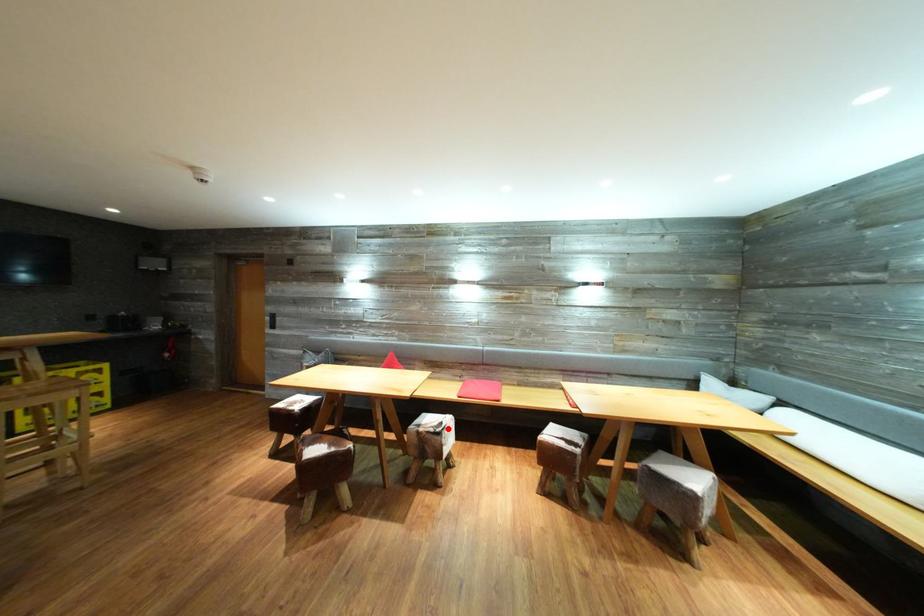
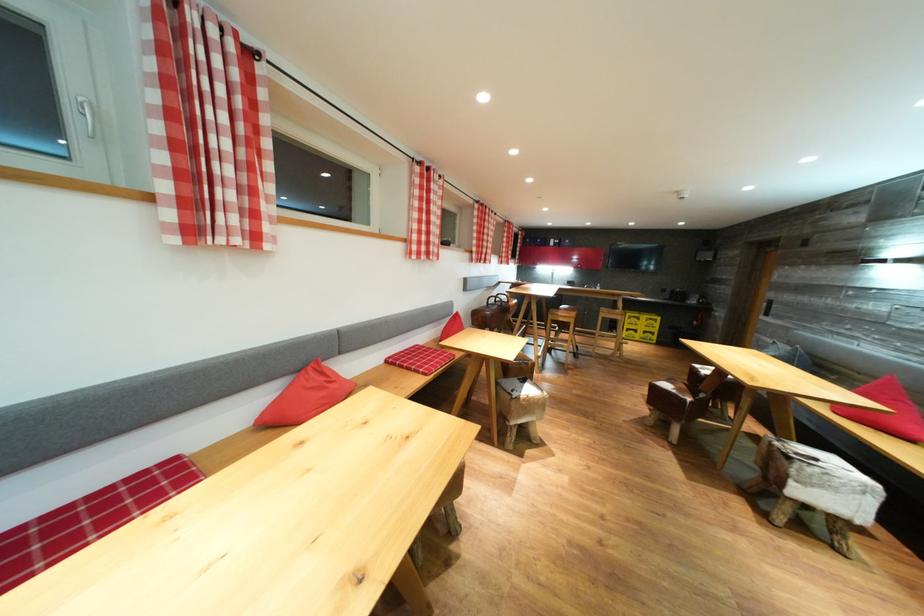
Find the pixel in the second image that matches the highlighted location in the first image.

(821, 464)